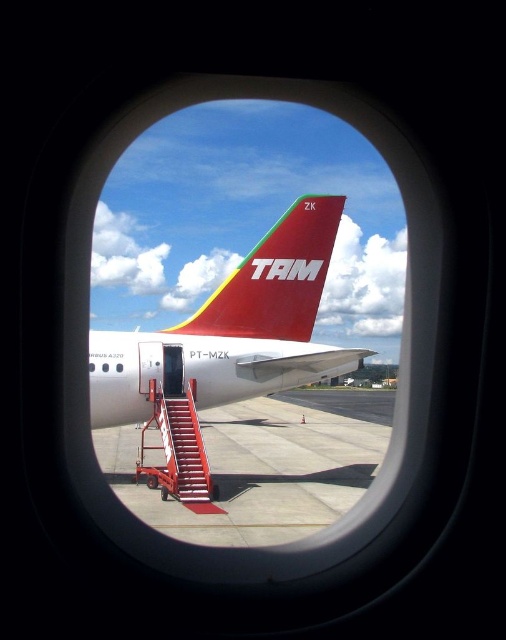
Is matte red airplane at center smaller than smooth concrete tarmac at center?

Correct, matte red airplane at center occupies less space than smooth concrete tarmac at center.

Which is above, matte red airplane at center or smooth concrete tarmac at center?

matte red airplane at center is higher up.

What do you see at coordinates (233, 330) in the screenshot?
I see `matte red airplane at center` at bounding box center [233, 330].

At what (x,y) coordinates should I click in order to perform the action: click on matte red airplane at center. Please return your answer as a coordinate pair (x, y). The image size is (506, 640). Looking at the image, I should click on (233, 330).

Does matte red airplane at center have a larger size compared to shiny red airplane tail at center?

Actually, matte red airplane at center might be smaller than shiny red airplane tail at center.

Between matte red airplane at center and shiny red airplane tail at center, which one has more height?

shiny red airplane tail at center

Image resolution: width=506 pixels, height=640 pixels. Find the location of `matte red airplane at center`. matte red airplane at center is located at coordinates (233, 330).

Describe the element at coordinates (267, 465) in the screenshot. Image resolution: width=506 pixels, height=640 pixels. I see `smooth concrete tarmac at center` at that location.

Is the position of smooth concrete tarmac at center less distant than that of shiny red airplane tail at center?

Yes, smooth concrete tarmac at center is closer to the viewer.

Find the location of `smooth concrete tarmac at center`. smooth concrete tarmac at center is located at coordinates (267, 465).

Where is `smooth concrete tarmac at center`? The image size is (506, 640). smooth concrete tarmac at center is located at coordinates (267, 465).